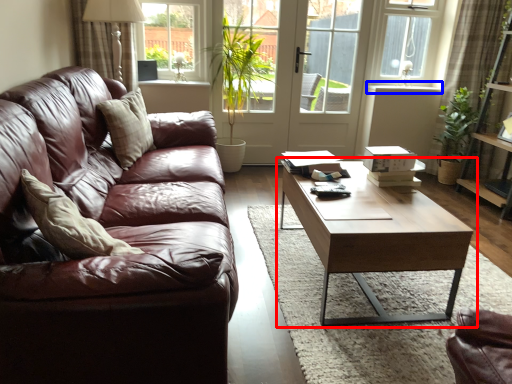
Question: Among these objects, which one is farthest to the camera, coffee table (highlighted by a red box) or window sill (highlighted by a blue box)?

Choices:
 (A) coffee table
 (B) window sill

Answer: (B)